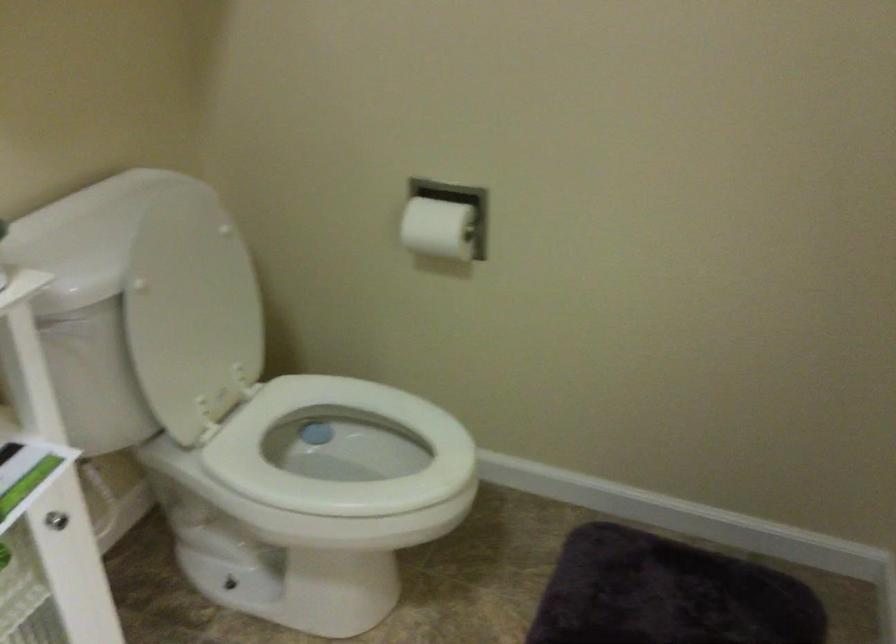
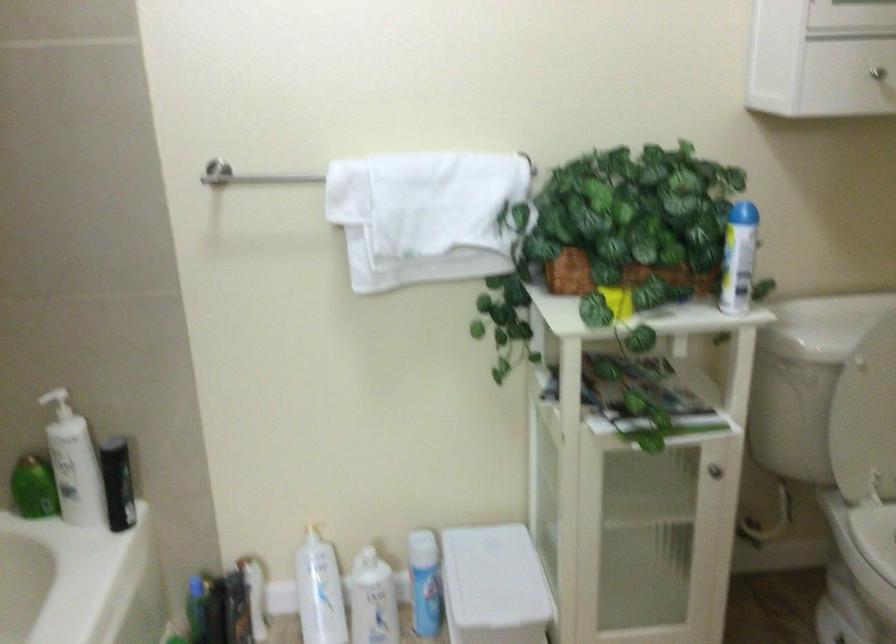
The point at (181,343) is marked in the first image. Where is the corresponding point in the second image?

(865, 413)